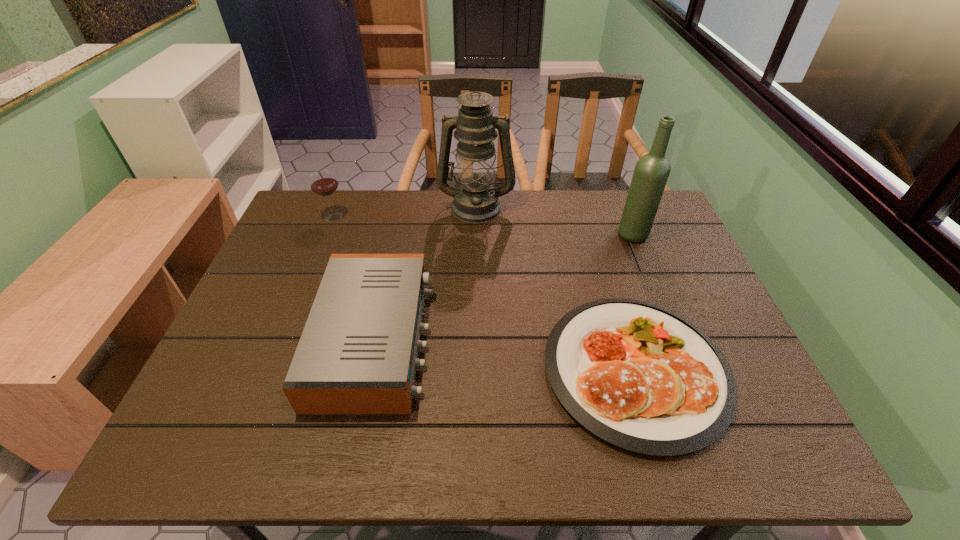
The width and height of the screenshot is (960, 540). In order to click on vacant area located on the left of the shortest object in this screenshot , I will do tap(495, 369).

What are the coordinates of `oil lamp at the far edge` in the screenshot? It's located at (475, 201).

Locate an element on the screen. The height and width of the screenshot is (540, 960). wine bottle situated at the far edge is located at coordinates [652, 170].

At what (x,y) coordinates should I click in order to perform the action: click on wineglass located at the far edge. Please return your answer as a coordinate pair (x, y). The height and width of the screenshot is (540, 960). Looking at the image, I should click on coord(323,182).

Find the location of a particular element. object that is at the near edge is located at coordinates (637, 375).

Find the location of a particular element. Image resolution: width=960 pixels, height=540 pixels. object that is at the left edge is located at coordinates (323, 182).

Identify the location of wine bottle at the right edge. This screenshot has height=540, width=960. (652, 170).

The width and height of the screenshot is (960, 540). I want to click on dish that is at the right edge, so click(x=637, y=375).

You are a GUI agent. You are given a task and a screenshot of the screen. Output one action in this format:
    pyautogui.click(x=<x>, y=<y>)
    Task: Click on the object that is at the far left corner
    
    Given the screenshot: What is the action you would take?
    pyautogui.click(x=323, y=182)

The image size is (960, 540). What are the coordinates of `object present at the far right corner` in the screenshot? It's located at (652, 170).